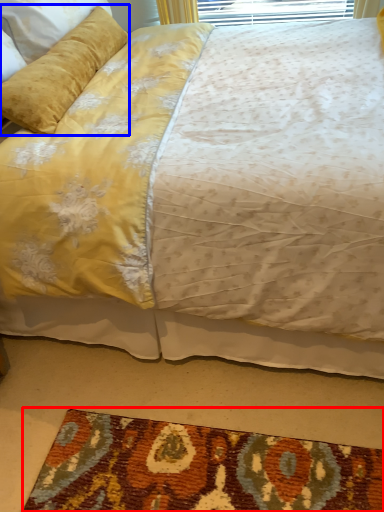
Question: Among these objects, which one is nearest to the camera, mat (highlighted by a red box) or pillow (highlighted by a blue box)?

Choices:
 (A) mat
 (B) pillow

Answer: (A)